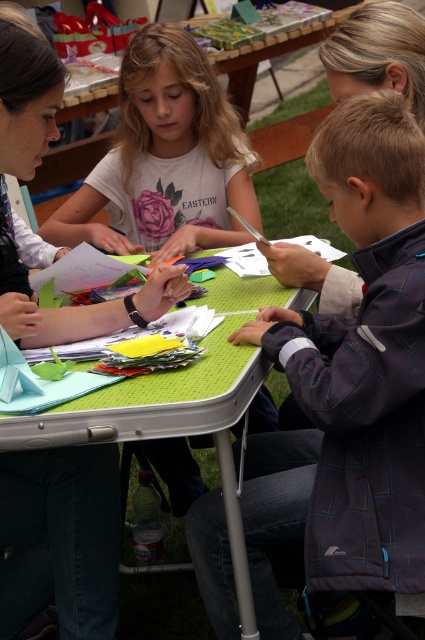
Question: Which object is farther from the camera taking this photo?

Choices:
 (A) green textured table at center
 (B) dark blue textured jacket at lower right

Answer: (B)

Question: Which object is closer to the camera taking this photo?

Choices:
 (A) green textured table at center
 (B) dark blue textured jacket at lower right

Answer: (A)

Question: Which of the following is the farthest from the observer?

Choices:
 (A) 136,68
 (B) 235,381
 (C) 306,449

Answer: (A)

Question: Is the position of dark blue textured jacket at lower right more distant than that of matte white shirt at upper center?

Choices:
 (A) no
 (B) yes

Answer: (A)

Question: Does dark blue textured jacket at lower right appear over green textured table at center?

Choices:
 (A) no
 (B) yes

Answer: (B)

Question: Can you confirm if matte white shirt at upper center is wider than green textured table at center?

Choices:
 (A) yes
 (B) no

Answer: (A)